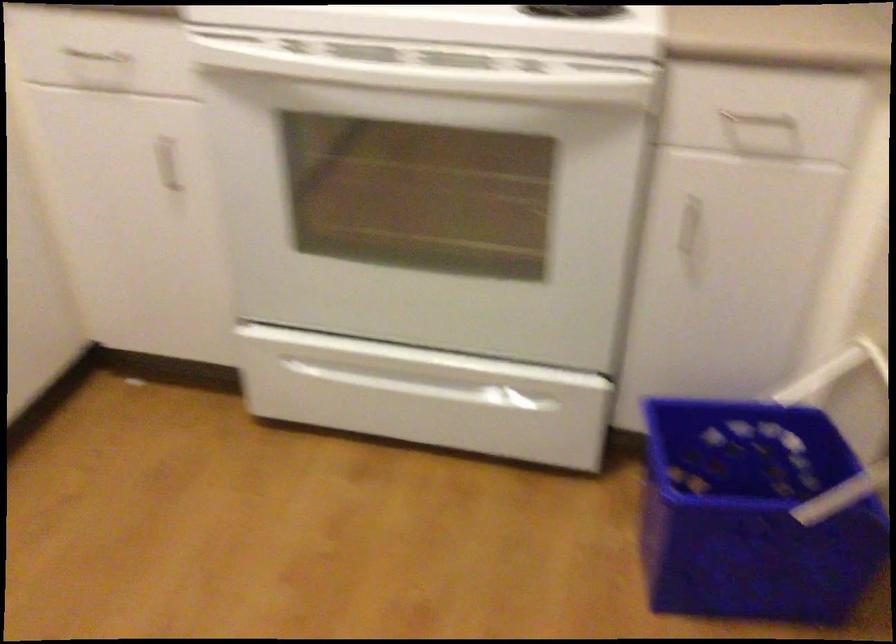
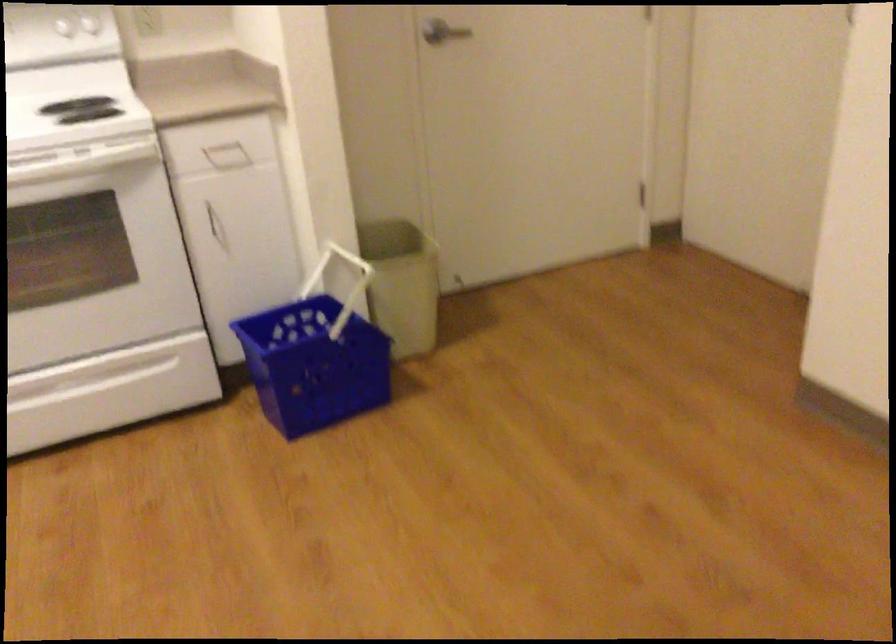
Question: How did the camera likely rotate?

Choices:
 (A) Left
 (B) Right
 (C) Up
 (D) Down

Answer: (B)